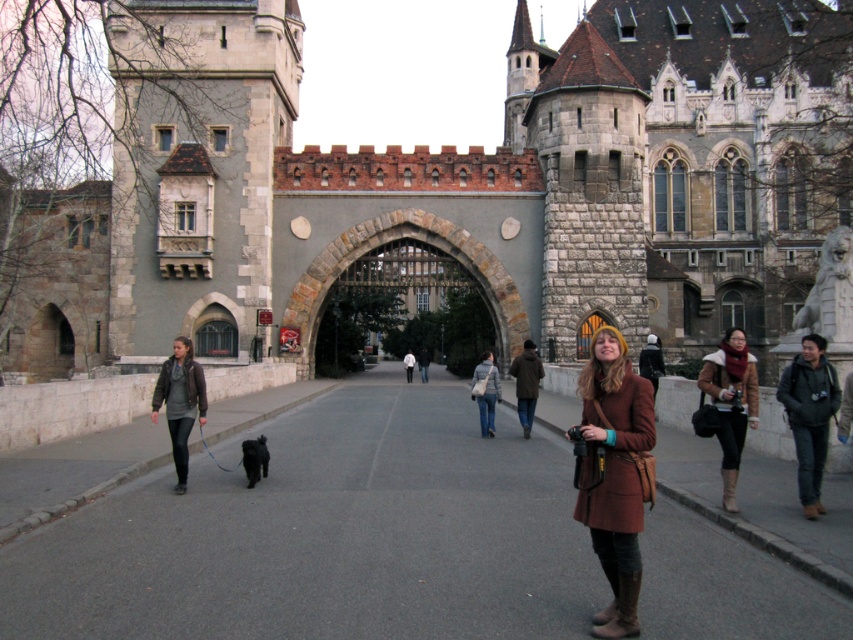
Question: Which object is the closest to the black fuzzy dog at center?

Choices:
 (A) brown wool coat at center
 (B) matte brown jacket at left
 (C) brown leather jacket at center
 (D) blue jeans at center

Answer: (B)

Question: Which of the following is the closest to the observer?

Choices:
 (A) black fuzzy dog at center
 (B) stone castle at center

Answer: (A)

Question: Can you confirm if brown wool coat at center is positioned below matte brown jacket at left?

Choices:
 (A) no
 (B) yes

Answer: (A)

Question: Can you confirm if matte brown jacket at left is positioned to the left of brown leather jacket at center?

Choices:
 (A) no
 (B) yes

Answer: (B)

Question: Which of the following is the closest to the observer?

Choices:
 (A) matte brown jacket at left
 (B) black fuzzy dog at center
 (C) blue jeans at center
 (D) dark gray jacket at right

Answer: (D)

Question: Is stone castle at center below matte brown jacket at left?

Choices:
 (A) no
 (B) yes

Answer: (A)